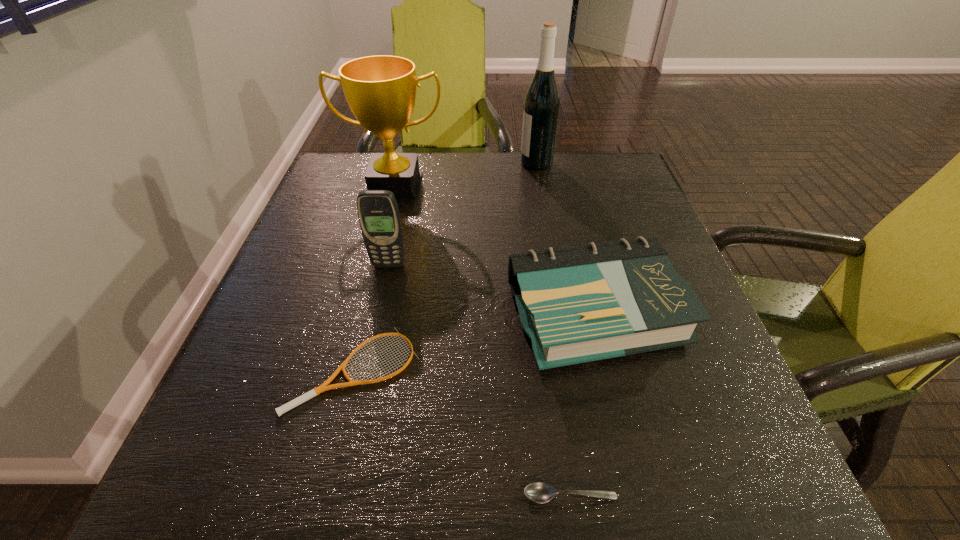
Where is `vacant space located on the screen of the third tallest object`? This screenshot has width=960, height=540. vacant space located on the screen of the third tallest object is located at coordinates (356, 411).

Find the location of a particular element. This screenshot has width=960, height=540. vacant point located on the left of the paperback book is located at coordinates (476, 314).

The width and height of the screenshot is (960, 540). Find the location of `free space located 0.160m on the right of the tennis racket`. free space located 0.160m on the right of the tennis racket is located at coordinates (516, 370).

This screenshot has height=540, width=960. What are the coordinates of `free region located 0.380m on the back of the nearest object` in the screenshot? It's located at (540, 285).

In order to click on wine bottle present at the far edge in this screenshot , I will do `click(542, 101)`.

What are the coordinates of `award that is at the far edge` in the screenshot? It's located at (380, 90).

Where is `object at the near edge`? The height and width of the screenshot is (540, 960). object at the near edge is located at coordinates (539, 492).

I want to click on award at the left edge, so click(380, 90).

This screenshot has height=540, width=960. Find the location of `tennis racket at the left edge`. tennis racket at the left edge is located at coordinates (323, 387).

Locate an element on the screen. This screenshot has width=960, height=540. object situated at the right edge is located at coordinates (579, 304).